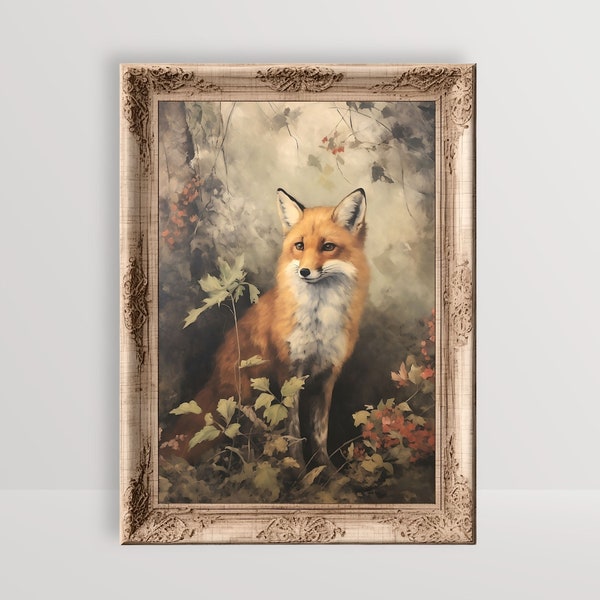
The width and height of the screenshot is (600, 600). Find the location of `chest`. chest is located at coordinates (317, 313).